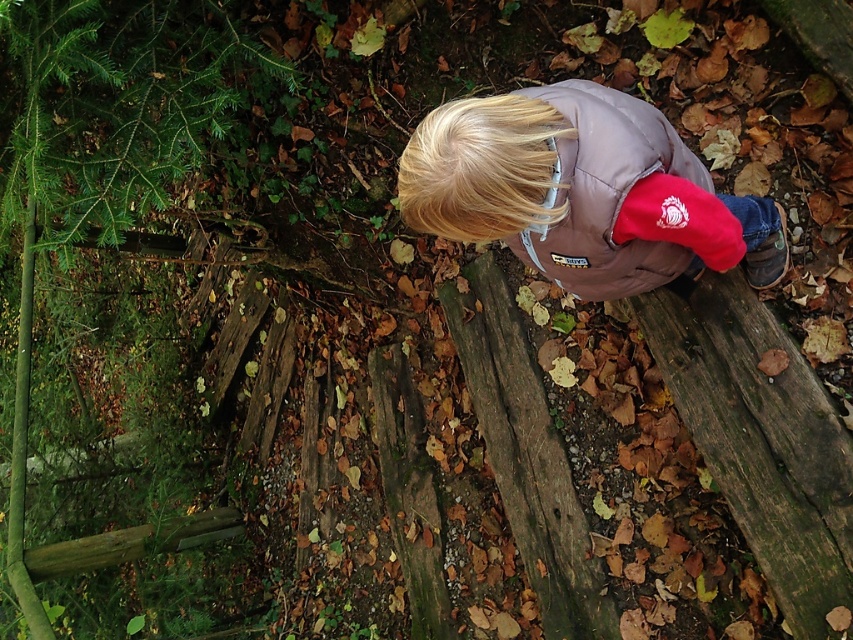
Question: Which object appears farthest from the camera in this image?

Choices:
 (A) green rough wood at center
 (B) brown matte jacket at center

Answer: (A)

Question: Is green textured pine tree at left smaller than green rough wood at center?

Choices:
 (A) no
 (B) yes

Answer: (A)

Question: Can you confirm if green textured pine tree at left is positioned to the right of brown matte jacket at center?

Choices:
 (A) no
 (B) yes

Answer: (A)

Question: Which point appears closest to the camera in this image?

Choices:
 (A) (91, 172)
 (B) (548, 275)

Answer: (B)

Question: Based on their relative distances, which object is farther from the brown matte jacket at center?

Choices:
 (A) green rough wood at center
 (B) green textured pine tree at left

Answer: (B)

Question: Is green textured pine tree at left smaller than brown matte jacket at center?

Choices:
 (A) yes
 (B) no

Answer: (B)